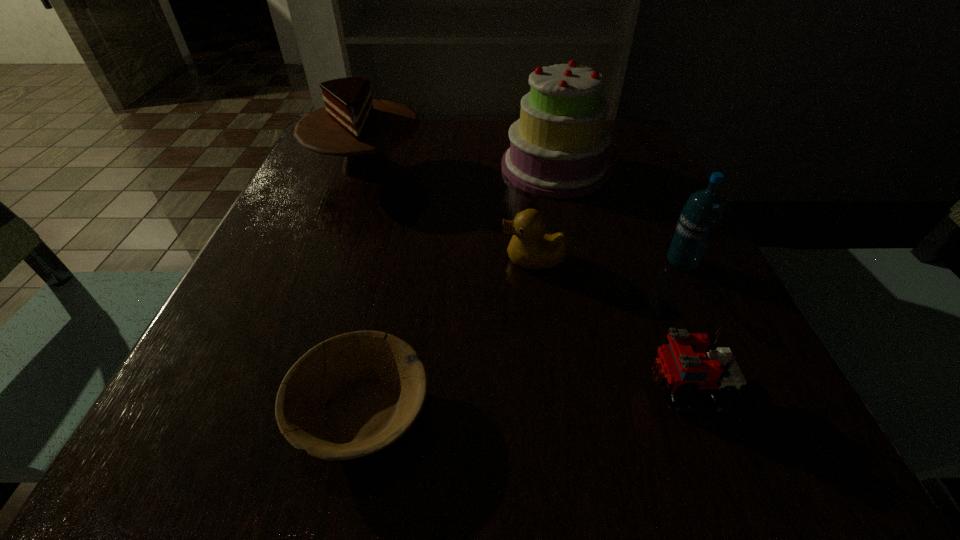
The width and height of the screenshot is (960, 540). In order to click on free spot between the shortest object and the shorter cake in this screenshot , I will do `click(363, 288)`.

This screenshot has height=540, width=960. I want to click on object that stands as the fifth closest to the bowl, so click(699, 219).

You are a GUI agent. You are given a task and a screenshot of the screen. Output one action in this format:
    pyautogui.click(x=<x>, y=<y>)
    Task: Click on the object that can be found as the second closest to the right cake
    The height and width of the screenshot is (540, 960).
    Given the screenshot: What is the action you would take?
    pyautogui.click(x=699, y=219)

I want to click on free location that satisfies the following two spatial constraints: 1. on the front side of the shorter cake; 2. on the left side of the bowl, so click(x=278, y=410).

Where is `free location that satisfies the following two spatial constraints: 1. on the face of the duckling; 2. on the right side of the water bottle`? This screenshot has height=540, width=960. free location that satisfies the following two spatial constraints: 1. on the face of the duckling; 2. on the right side of the water bottle is located at coordinates (534, 263).

You are a GUI agent. You are given a task and a screenshot of the screen. Output one action in this format:
    pyautogui.click(x=<x>, y=<y>)
    Task: Click on the vacant space that satisfies the following two spatial constraints: 1. on the face of the duckling; 2. on the back side of the water bottle
    The image size is (960, 540).
    Given the screenshot: What is the action you would take?
    pyautogui.click(x=534, y=263)

Identify the location of free space that satisfies the following two spatial constraints: 1. on the face of the water bottle; 2. on the left side of the duckling. (534, 263).